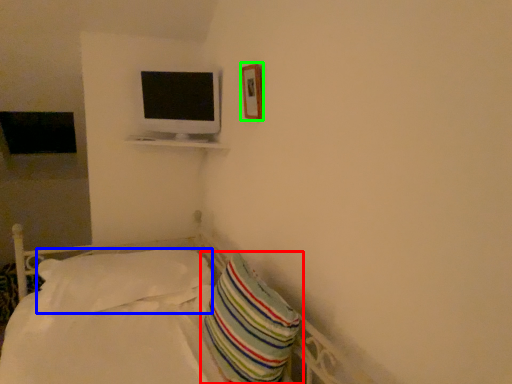
Question: Estimate the real-world distances between objects in this image. Which object is farther from pillow (highlighted by a red box), pillow (highlighted by a blue box) or picture frame (highlighted by a green box)?

Choices:
 (A) pillow
 (B) picture frame

Answer: (B)